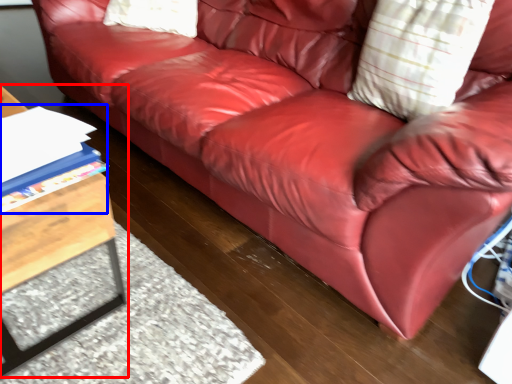
Question: Which of the following is the closest to the observer, table (highlighted by a red box) or book (highlighted by a blue box)?

Choices:
 (A) table
 (B) book

Answer: (A)